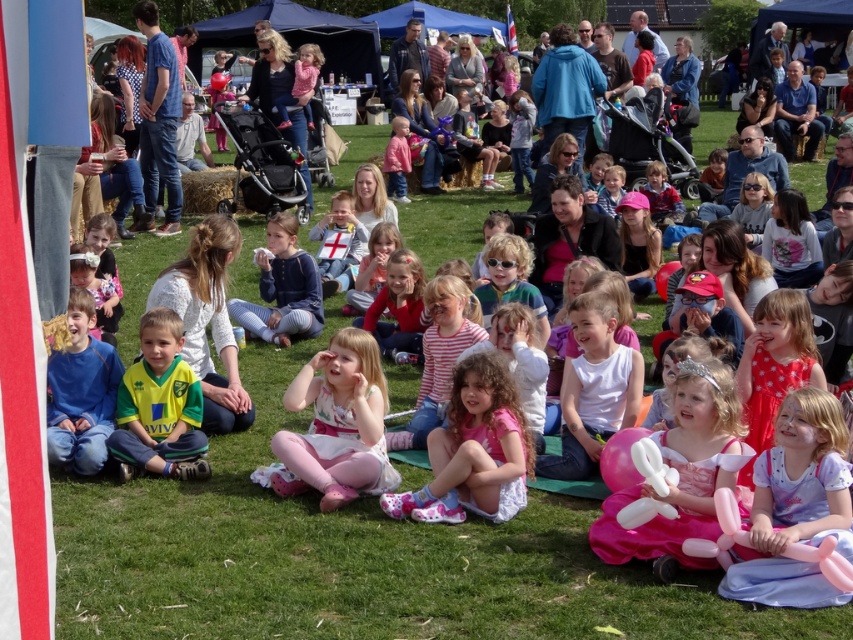
You are a photographer positioned at the center of the field. You need to take a photo that includes the pink satin dress at center. Based on its position, where should you aim your camera to ensure it is in the frame?

The pink satin dress at center is located at point (335, 426), so you should aim your camera slightly to the right and above the center to capture it within the frame.

You are a photographer at the event and want to capture a photo that includes both the pink fabric dress at center and the pink rubber balloon animal at lower right. Which object should you focus on first to ensure both are in frame?

The pink fabric dress at center is larger in size compared to the pink rubber balloon animal at lower right, so you should focus on the pink fabric dress at center first to ensure both are in frame.

You are taking a photo of the lively outdoor gathering. You want to focus on the point at point (352, 458) and point (144, 448). Which point is closer to your camera?

Point (352, 458) is closer to the camera than point (144, 448).